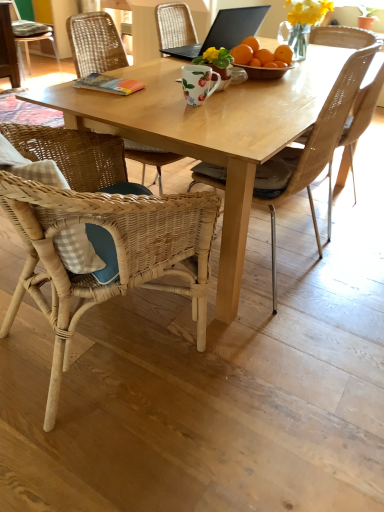
You are a GUI agent. You are given a task and a screenshot of the screen. Output one action in this format:
    pyautogui.click(x=<x>, y=<y>)
    Task: Click on the vacant area located to the right-hand side of woven wicker chair at lower left, the 4th chair when ordered from back to front
    
    Given the screenshot: What is the action you would take?
    pyautogui.click(x=286, y=386)